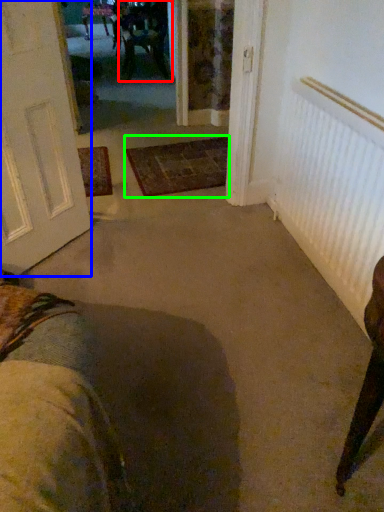
Question: Which object is the closest to the chair (highlighted by a red box)? Choose among these: door (highlighted by a blue box) or doormat (highlighted by a green box).

Choices:
 (A) door
 (B) doormat

Answer: (B)